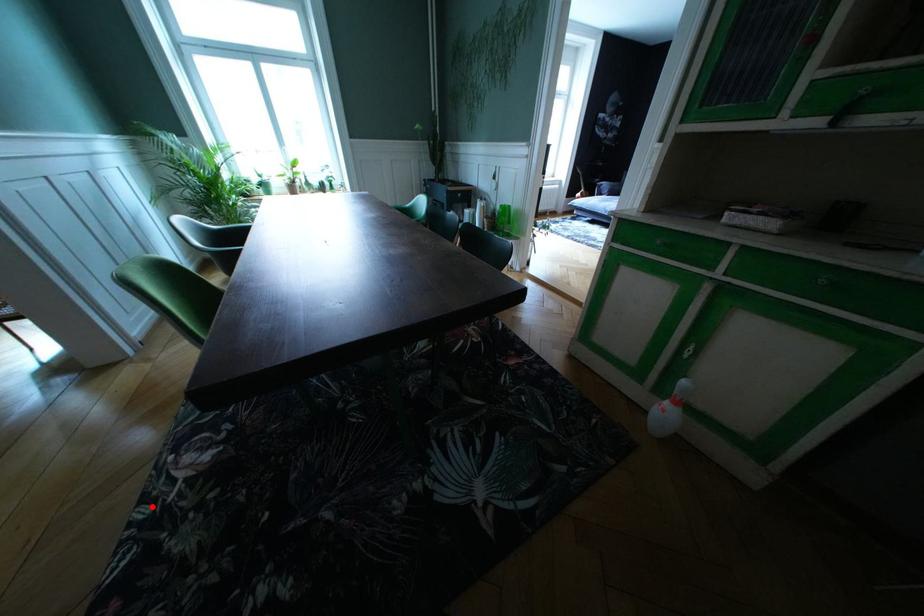
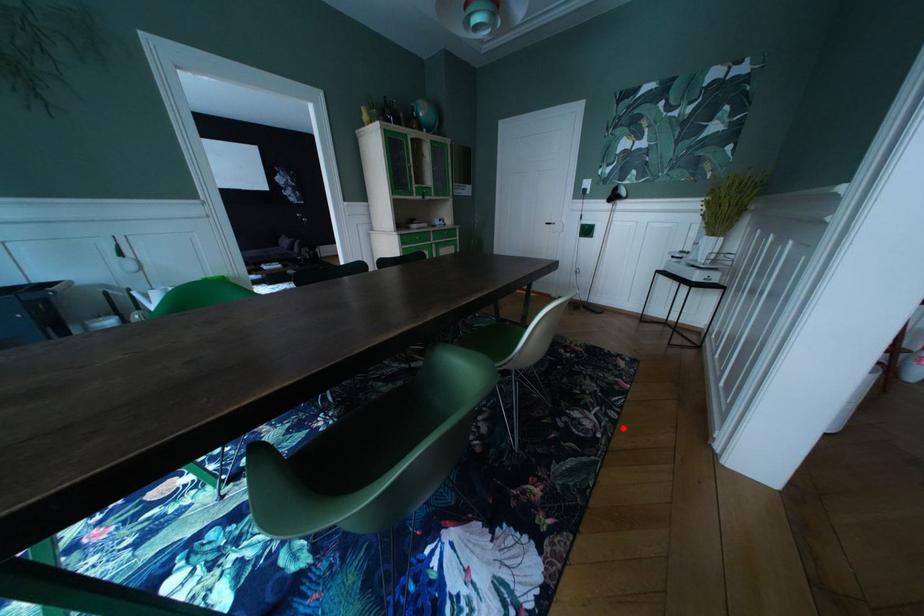
I am providing you with two images of the same scene from different viewpoints. A red point is marked on the first image and another point is marked on the second image. Do the highlighted points in image1 and image2 indicate the same real-world spot?

Yes